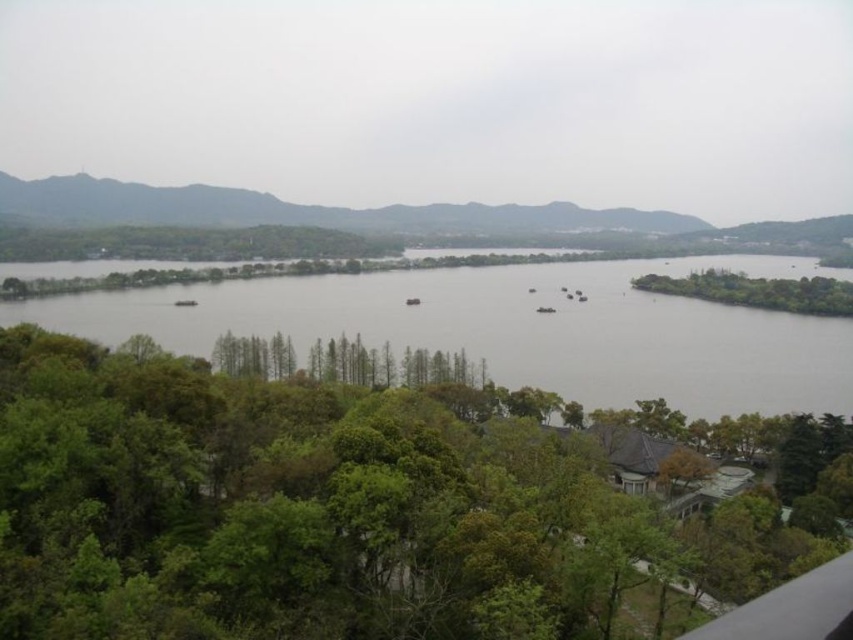
You are standing in the serene landscape and want to take a photo of the green matte mountains at upper left and the green leafy tree at right. Which object should you focus on first if you want both to be in clear focus?

You should focus on the green leafy tree at right first because it is closer to you than the green matte mountains at upper left, which are further away. By focusing on the closer object, you can ensure both are in focus using the depth of field.

You are standing in the serene landscape scene. There are two points marked in the image. The first point is at coordinate point (465, 467) and the second is at coordinate point (842, 220). Which point is closer to you?

Point (465, 467) is closer to the viewer than point (842, 220).